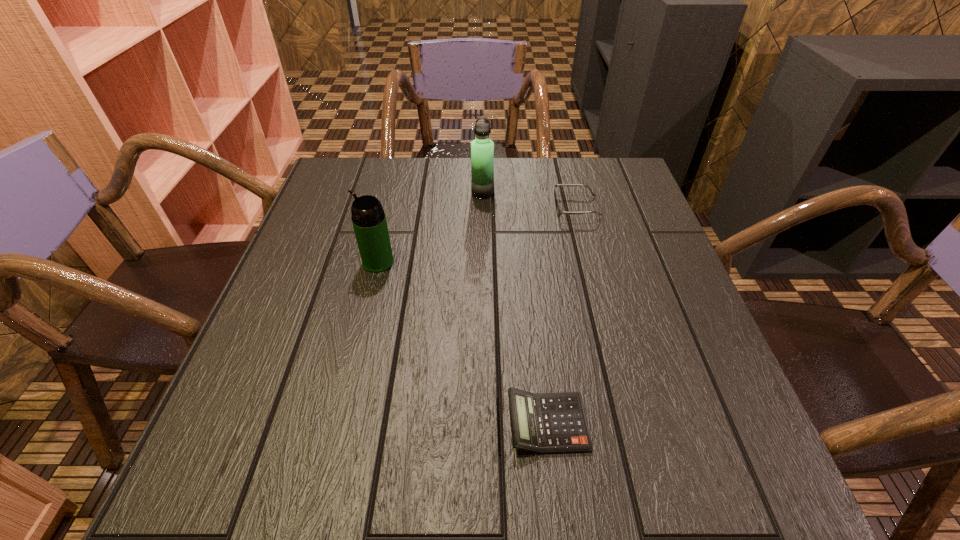
I want to click on vacant region that satisfies the following two spatial constraints: 1. from the spout of the third farthest object; 2. on the left side of the calculator, so click(340, 423).